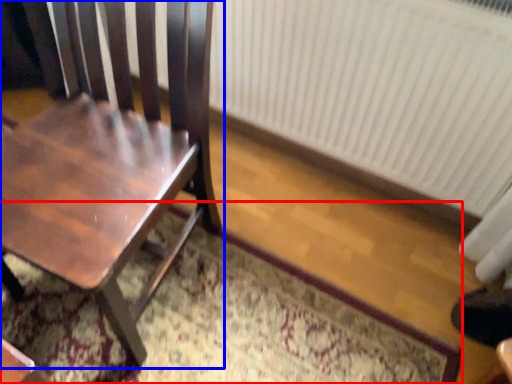
Question: Among these objects, which one is nearest to the camera, doormat (highlighted by a red box) or chair (highlighted by a blue box)?

Choices:
 (A) doormat
 (B) chair

Answer: (B)